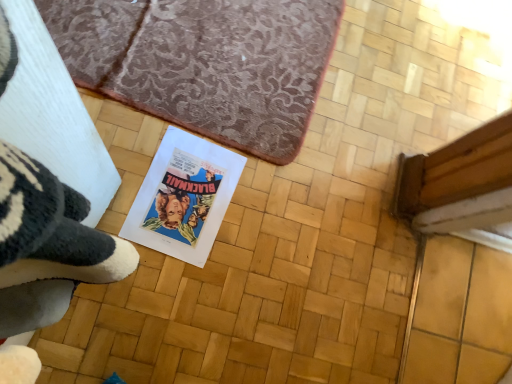
Where is `free spot above matte paper book at center (from a real-world perspective)`? This screenshot has height=384, width=512. free spot above matte paper book at center (from a real-world perspective) is located at coordinates [185, 198].